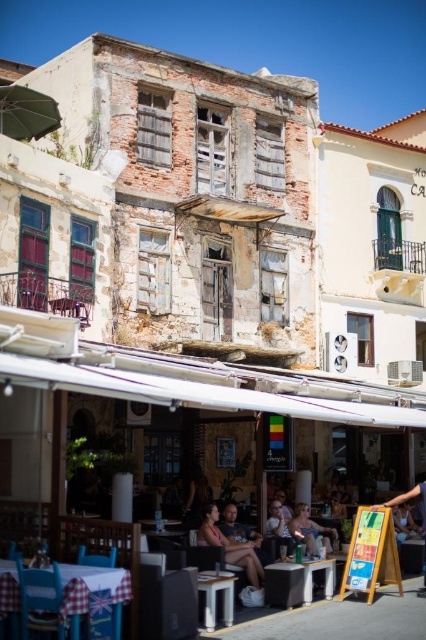
Question: Can you confirm if matte pink tank top at center is positioned below dark brown leather jacket at lower right?

Choices:
 (A) yes
 (B) no

Answer: (B)

Question: Which is farther from the green matte umbrella at upper left?

Choices:
 (A) matte black table at center
 (B) dark brown leather jacket at lower right
 (C) smooth skin face at lower center
 (D) white glossy table at center

Answer: (B)

Question: Estimate the real-world distances between objects in this image. Which object is farther from the matte pink tank top at center?

Choices:
 (A) smooth skin face at lower center
 (B) checkered fabric table at lower left

Answer: (B)

Question: Does green matte umbrella at upper left appear under matte black sunglasses at center?

Choices:
 (A) yes
 (B) no

Answer: (B)

Question: Is checkered fabric table at lower left wider than matte black table at center?

Choices:
 (A) no
 (B) yes

Answer: (A)

Question: Among these objects, which one is farthest from the camera?

Choices:
 (A) green matte umbrella at upper left
 (B) white glossy table at center
 (C) matte pink tank top at center

Answer: (A)